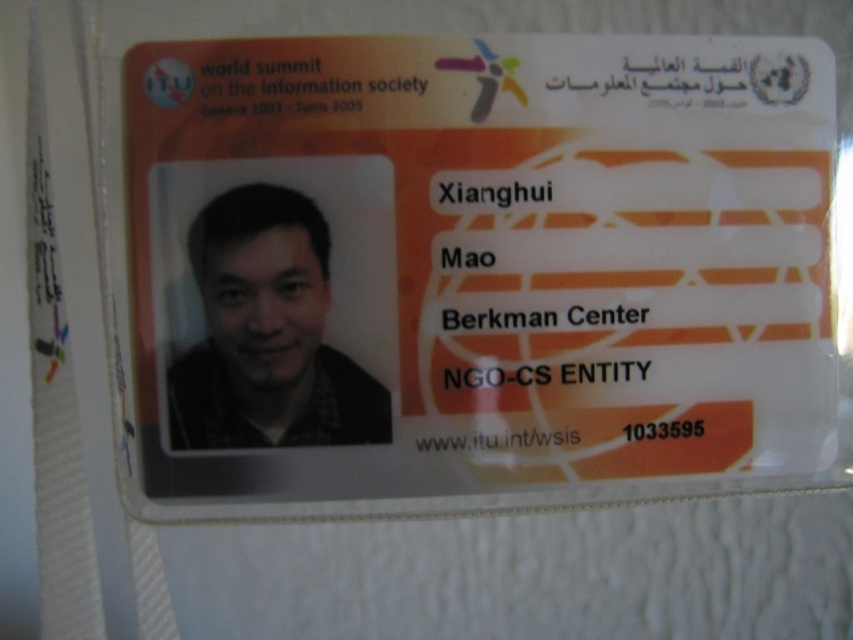
What do you see at coordinates (476, 262) in the screenshot?
I see `orange matte id card at center` at bounding box center [476, 262].

Is orange matte id card at center positioned in front of matte black photo at center?

Yes, orange matte id card at center is closer to the viewer.

The image size is (853, 640). I want to click on orange matte id card at center, so click(476, 262).